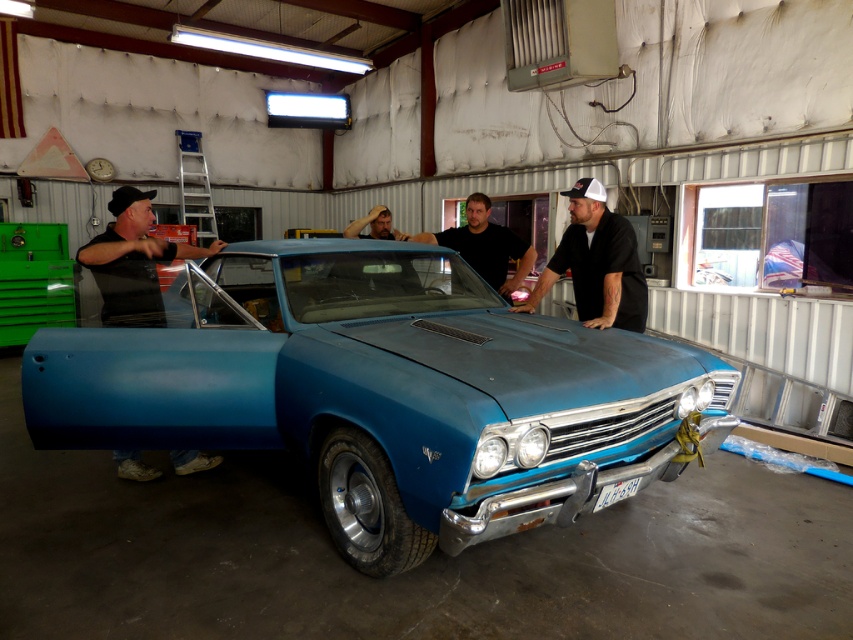
Question: Among these points, which one is farthest from the camera?

Choices:
 (A) (553, 262)
 (B) (450, 236)
 (C) (496, 435)
 (D) (102, 314)

Answer: (B)

Question: Does blue matte car at center appear on the left side of matte black shirt at center?

Choices:
 (A) yes
 (B) no

Answer: (A)

Question: Among these objects, which one is nearest to the camera?

Choices:
 (A) black matte shirt at left
 (B) black matte shirt at center
 (C) blue matte car at center
 (D) matte black shirt at center

Answer: (C)

Question: Is black matte shirt at center further to the viewer compared to matte black shirt at center?

Choices:
 (A) yes
 (B) no

Answer: (B)

Question: Which object appears farthest from the camera in this image?

Choices:
 (A) matte black shirt at center
 (B) black matte shirt at left

Answer: (A)

Question: Is blue matte car at center further to the viewer compared to black matte shirt at center?

Choices:
 (A) yes
 (B) no

Answer: (B)